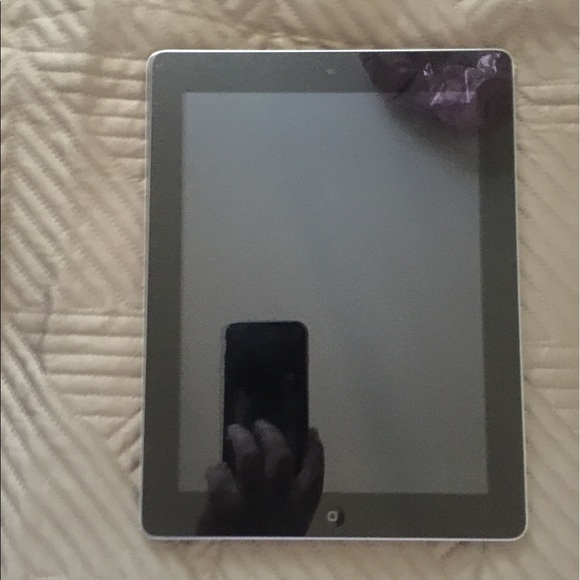
I want to click on tablet screen, so click(367, 451).